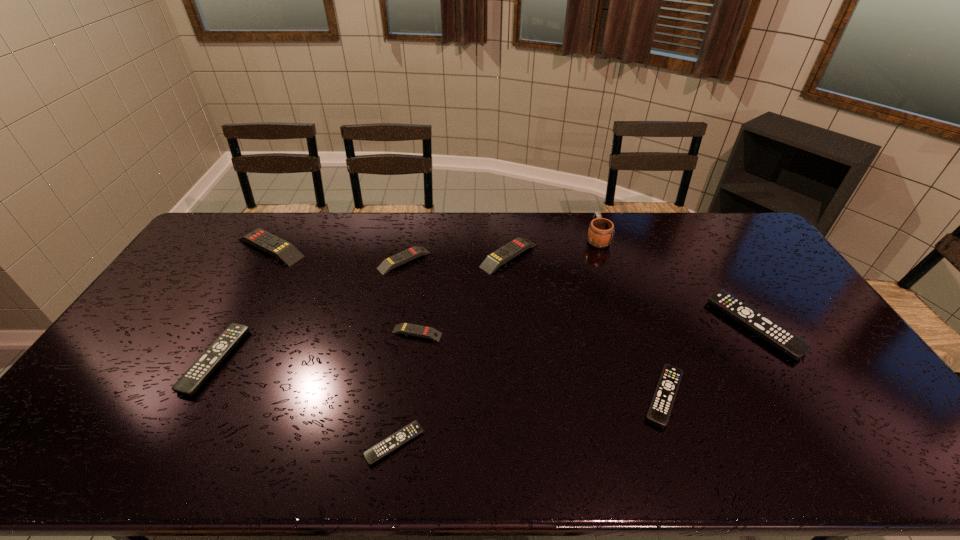
You are a GUI agent. You are given a task and a screenshot of the screen. Output one action in this format:
    pyautogui.click(x=<x>, y=<y>)
    Task: Click on the vacant space at the near edge of the desktop
    
    Given the screenshot: What is the action you would take?
    tap(616, 458)

Identify the location of free space at the left edge of the desktop. (182, 280).

Locate an element on the screen. The height and width of the screenshot is (540, 960). vacant space at the right edge is located at coordinates (853, 379).

Locate an element on the screen. The height and width of the screenshot is (540, 960). vacant region at the far left corner of the desktop is located at coordinates (251, 212).

Where is `free space between the sixth object from left to right and the second smallest yellow remote control`? This screenshot has width=960, height=540. free space between the sixth object from left to right and the second smallest yellow remote control is located at coordinates (456, 258).

Identify the location of vacant area that lies between the second smallest yellow remote control and the second smallest black remote control. (534, 328).

Find the location of a particular element. The image size is (960, 540). free space between the rightmost yellow remote control and the biggest yellow remote control is located at coordinates (390, 252).

You are a GUI agent. You are given a task and a screenshot of the screen. Output one action in this format:
    pyautogui.click(x=<x>, y=<y>)
    Task: Click on the blank region between the third biggest yellow remote control and the second biggest yellow remote control
    The image size is (960, 540).
    Given the screenshot: What is the action you would take?
    pyautogui.click(x=456, y=258)

Find the location of a particular element. This screenshot has width=960, height=540. vacant area that lies between the second biggest yellow remote control and the tallest object is located at coordinates (553, 247).

The width and height of the screenshot is (960, 540). I want to click on free space between the shortest remote control and the second biggest black remote control, so click(x=304, y=402).